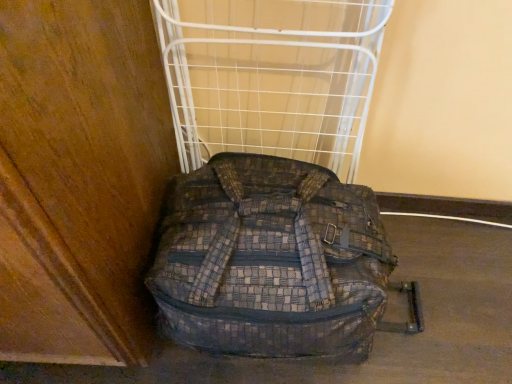
Find the location of a particular element. The width and height of the screenshot is (512, 384). white wire rack at center is located at coordinates 271,76.

What do you see at coordinates (271, 76) in the screenshot? I see `white wire rack at center` at bounding box center [271, 76].

What is the approximate width of plaid fabric backpack at center?

It is 19.38 inches.

The image size is (512, 384). What do you see at coordinates (274, 261) in the screenshot?
I see `plaid fabric backpack at center` at bounding box center [274, 261].

At what (x,y) coordinates should I click in order to perform the action: click on plaid fabric backpack at center. Please return your answer as a coordinate pair (x, y). Looking at the image, I should click on (274, 261).

Identify the location of white wire rack at center. (271, 76).

Based on their positions, is white wire rack at center located to the left or right of plaid fabric backpack at center?

Clearly, white wire rack at center is on the left of plaid fabric backpack at center in the image.

Is white wire rack at center positioned in front of plaid fabric backpack at center?

That is False.

Considering the positions of points (240, 119) and (226, 320), is point (240, 119) farther from camera compared to point (226, 320)?

Yes, point (240, 119) is behind point (226, 320).

From the image's perspective, which one is positioned lower, white wire rack at center or plaid fabric backpack at center?

plaid fabric backpack at center is shown below in the image.

Based on the photo, from a real-world perspective, relative to plaid fabric backpack at center, is white wire rack at center vertically above or below?

white wire rack at center is situated higher than plaid fabric backpack at center in the real world.

Which of these two, white wire rack at center or plaid fabric backpack at center, is wider?

plaid fabric backpack at center is wider.

Which of these two, white wire rack at center or plaid fabric backpack at center, stands shorter?

Standing shorter between the two is plaid fabric backpack at center.

Looking at this image, who is bigger, white wire rack at center or plaid fabric backpack at center?

Bigger between the two is plaid fabric backpack at center.

Choose the correct answer: Is white wire rack at center inside plaid fabric backpack at center or outside it?

white wire rack at center is outside plaid fabric backpack at center.

Is white wire rack at center not near plaid fabric backpack at center?

No, white wire rack at center is not far away from plaid fabric backpack at center.

Is white wire rack at center looking in the opposite direction of plaid fabric backpack at center?

No, plaid fabric backpack at center is not at the back of white wire rack at center.

How far apart are white wire rack at center and plaid fabric backpack at center?

They are 11.50 inches apart.

The image size is (512, 384). Find the location of `cage on the left side of plaid fabric backpack at center`. cage on the left side of plaid fabric backpack at center is located at coordinates (271, 76).

Which is more to the right, plaid fabric backpack at center or white wire rack at center?

From the viewer's perspective, plaid fabric backpack at center appears more on the right side.

Considering the relative positions of plaid fabric backpack at center and white wire rack at center in the image provided, is plaid fabric backpack at center in front of white wire rack at center?

Yes, it is in front of white wire rack at center.

Considering the positions of point (321, 178) and point (358, 90), is point (321, 178) closer or farther from the camera than point (358, 90)?

Point (321, 178) appears to be closer to the viewer than point (358, 90).

From the image's perspective, is plaid fabric backpack at center on top of white wire rack at center?

No, from the image's perspective, plaid fabric backpack at center is not on top of white wire rack at center.

From a real-world perspective, which is physically above, plaid fabric backpack at center or white wire rack at center?

white wire rack at center is physically above.

Considering the sizes of objects plaid fabric backpack at center and white wire rack at center in the image provided, who is wider, plaid fabric backpack at center or white wire rack at center?

plaid fabric backpack at center.

From their relative heights in the image, would you say plaid fabric backpack at center is taller or shorter than white wire rack at center?

Considering their sizes, plaid fabric backpack at center has less height than white wire rack at center.

In the scene shown: In terms of size, does plaid fabric backpack at center appear bigger or smaller than white wire rack at center?

plaid fabric backpack at center is bigger than white wire rack at center.

Is white wire rack at center completely or partially inside plaid fabric backpack at center?

No, white wire rack at center is located outside of plaid fabric backpack at center.

Is there a large distance between plaid fabric backpack at center and white wire rack at center?

plaid fabric backpack at center is actually quite close to white wire rack at center.

Is plaid fabric backpack at center turned away from white wire rack at center?

Yes, plaid fabric backpack at center's orientation is away from white wire rack at center.

What's the angular difference between plaid fabric backpack at center and white wire rack at center's facing directions?

There is a 3.16-degree angle between the facing directions of plaid fabric backpack at center and white wire rack at center.

The height and width of the screenshot is (384, 512). I want to click on backpack lying on the right of white wire rack at center, so click(x=274, y=261).

In order to click on cage that appears on the left of plaid fabric backpack at center in this screenshot , I will do `click(271, 76)`.

Where is `backpack located on the right of white wire rack at center`? This screenshot has width=512, height=384. backpack located on the right of white wire rack at center is located at coordinates (274, 261).